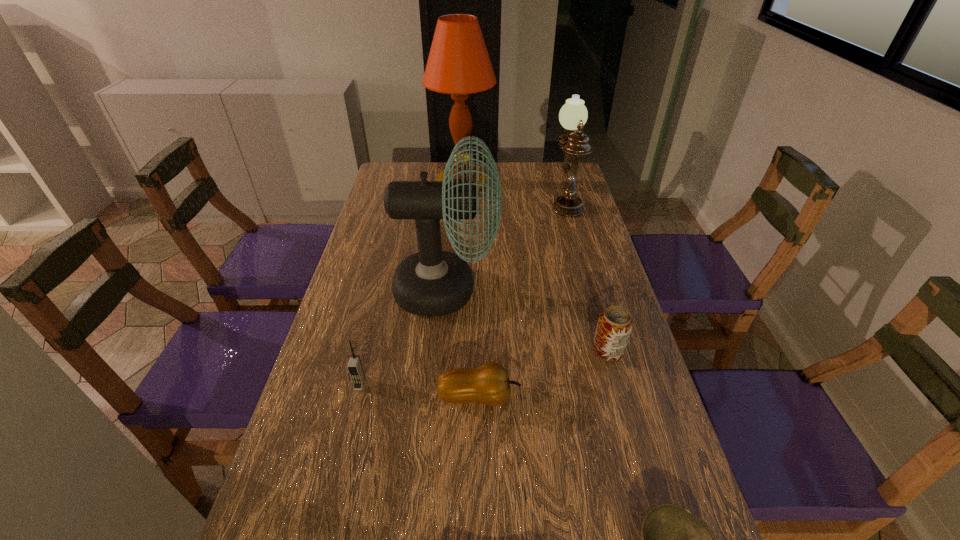
The image size is (960, 540). What are the coordinates of `lamp` in the screenshot? It's located at (458, 64).

I want to click on fan, so click(x=432, y=282).

This screenshot has height=540, width=960. I want to click on the sixth shortest object, so click(432, 282).

You are a GUI agent. You are given a task and a screenshot of the screen. Output one action in this format:
    pyautogui.click(x=<x>, y=<y>)
    Task: Click on the fifth shortest object
    
    Given the screenshot: What is the action you would take?
    pyautogui.click(x=573, y=115)

The height and width of the screenshot is (540, 960). I want to click on cellular telephone, so click(355, 368).

Where is `beer can`? The width and height of the screenshot is (960, 540). beer can is located at coordinates (615, 324).

Find the location of `the sixth tallest object`. the sixth tallest object is located at coordinates (489, 384).

Identify the location of free space located on the right of the lamp. The width and height of the screenshot is (960, 540). (518, 188).

In order to click on free region located 0.140m in front of the fifth nearest object where the airflow is directed in this screenshot , I will do `click(546, 290)`.

Locate an element on the screen. The height and width of the screenshot is (540, 960). blank space located 0.280m on the left of the fifth shortest object is located at coordinates (476, 200).